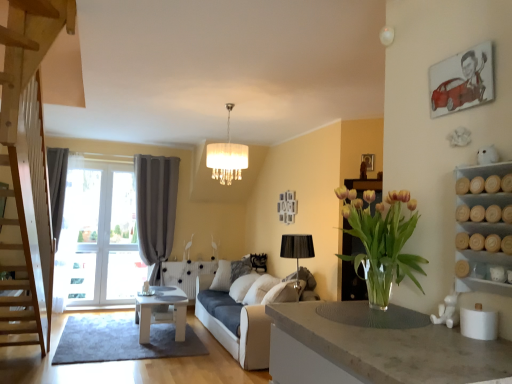
Question: From a real-world perspective, is white fabric lampshade at center beneath white fabric couch at center?

Choices:
 (A) yes
 (B) no

Answer: (B)

Question: Is white fabric lampshade at center not close to white fabric couch at center?

Choices:
 (A) yes
 (B) no

Answer: (A)

Question: Can you confirm if white fabric lampshade at center is taller than white fabric couch at center?

Choices:
 (A) yes
 (B) no

Answer: (A)

Question: Is white fabric lampshade at center behind white fabric couch at center?

Choices:
 (A) yes
 (B) no

Answer: (B)

Question: Is white fabric lampshade at center to the left of white fabric couch at center from the viewer's perspective?

Choices:
 (A) yes
 (B) no

Answer: (A)

Question: Could you tell me if white fabric lampshade at center is turned towards white fabric couch at center?

Choices:
 (A) yes
 (B) no

Answer: (B)

Question: Does wooden cylindrical containers at right lie in front of white fabric lampshade at center?

Choices:
 (A) no
 (B) yes

Answer: (B)

Question: Could you tell me if wooden cylindrical containers at right is facing white fabric lampshade at center?

Choices:
 (A) yes
 (B) no

Answer: (B)

Question: Is wooden cylindrical containers at right thinner than white fabric lampshade at center?

Choices:
 (A) yes
 (B) no

Answer: (A)

Question: Does wooden cylindrical containers at right have a lesser height compared to white fabric lampshade at center?

Choices:
 (A) yes
 (B) no

Answer: (A)

Question: Is the surface of wooden cylindrical containers at right in direct contact with white fabric lampshade at center?

Choices:
 (A) yes
 (B) no

Answer: (B)

Question: Is white fabric lampshade at center a part of wooden cylindrical containers at right?

Choices:
 (A) yes
 (B) no

Answer: (B)

Question: Is gray fabric curtain at left further to the viewer compared to white textured pillow at center?

Choices:
 (A) no
 (B) yes

Answer: (B)